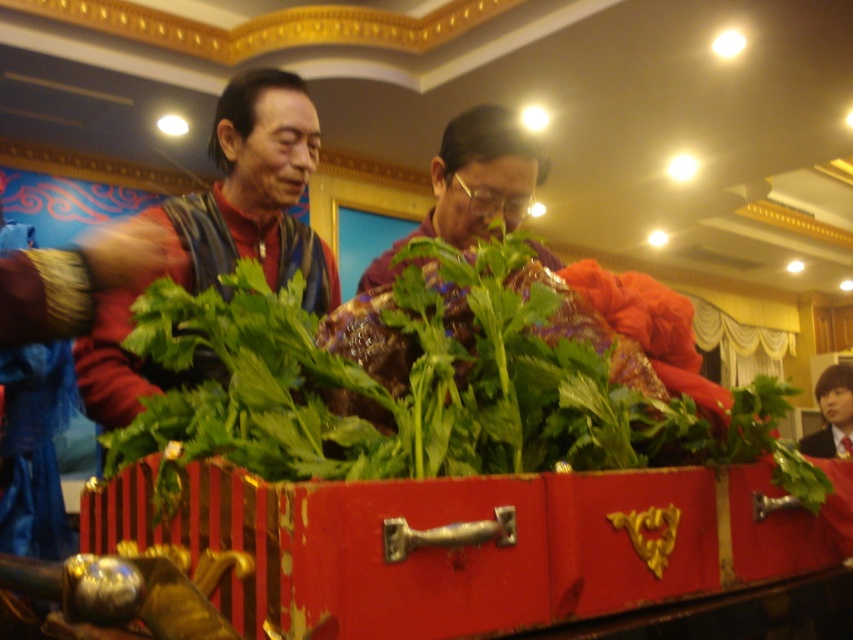
At what (x,y) coordinates should I click in order to perform the action: click on green leafy vegetable at center. Please return your answer as a coordinate pair (x, y). Image resolution: width=853 pixels, height=640 pixels. Looking at the image, I should click on (437, 381).

Is point (187, 445) more distant than point (288, 237)?

No, (187, 445) is in front of (288, 237).

Locate an element on the screen. Image resolution: width=853 pixels, height=640 pixels. green leafy vegetable at center is located at coordinates (437, 381).